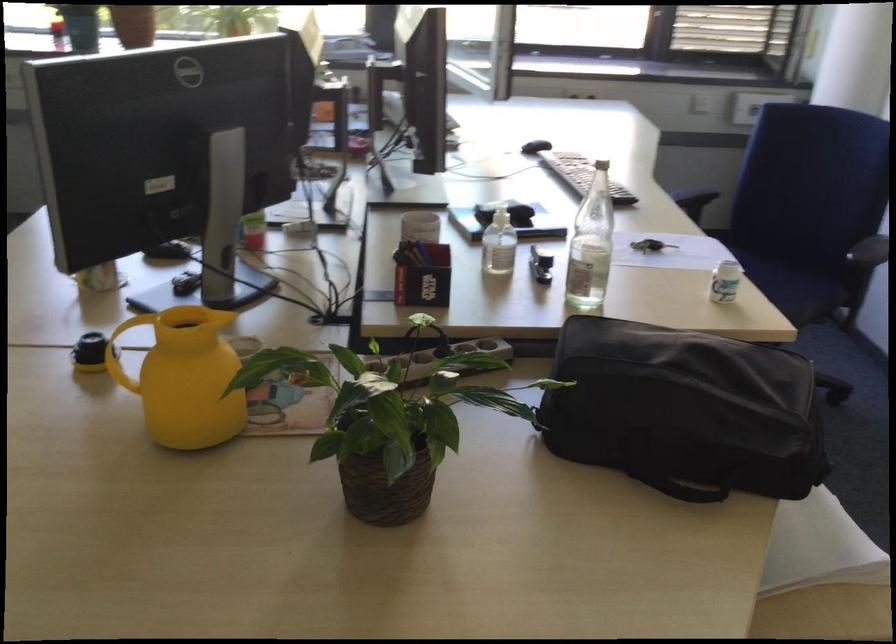
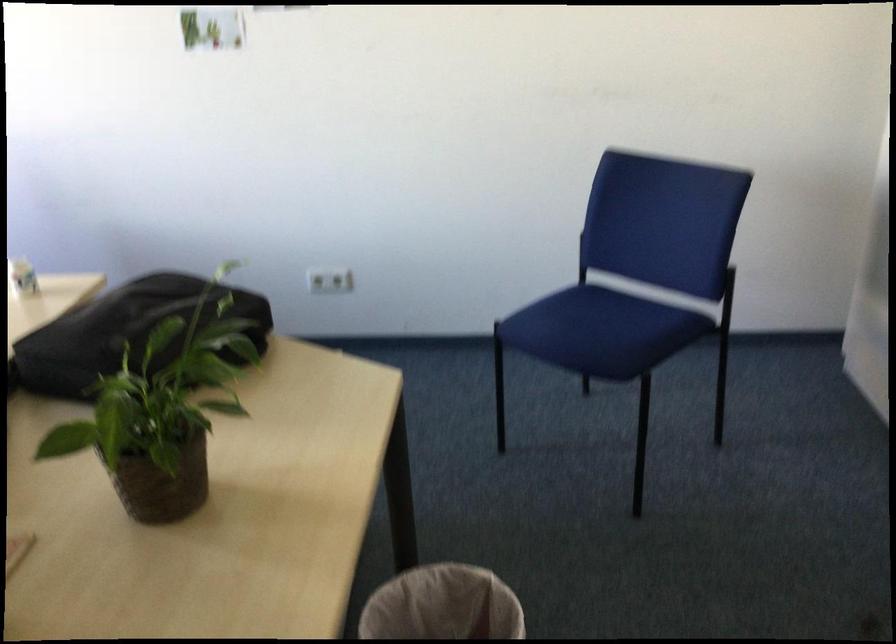
Question: I am providing you with two images of the same scene from different viewpoints. After the viewpoint changes to image2, which objects are now occluded?

Choices:
 (A) trash can
 (B) black bag handle
 (C) silver blind knob
 (D) black bag

Answer: (B)